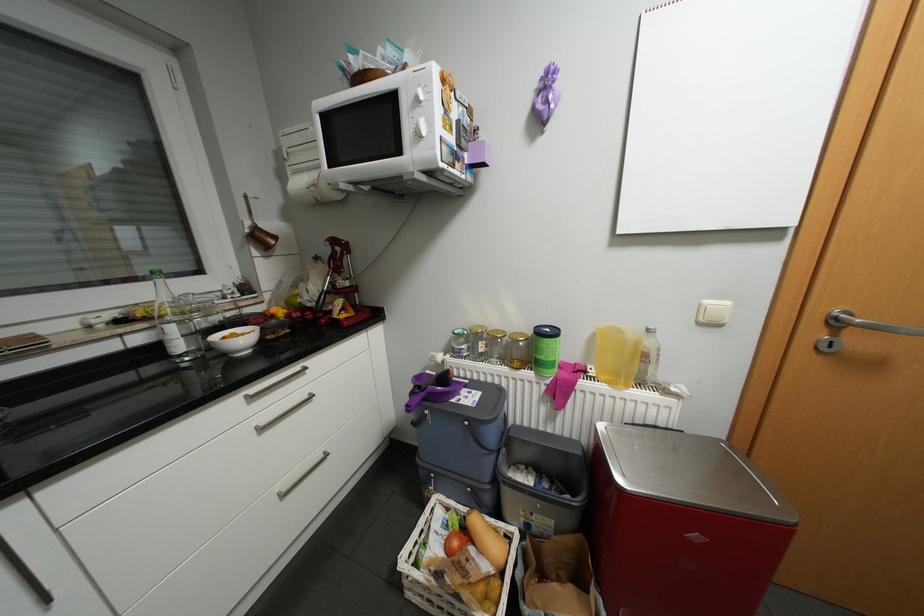
Which object does [545,350] point to?

It refers to a green container.